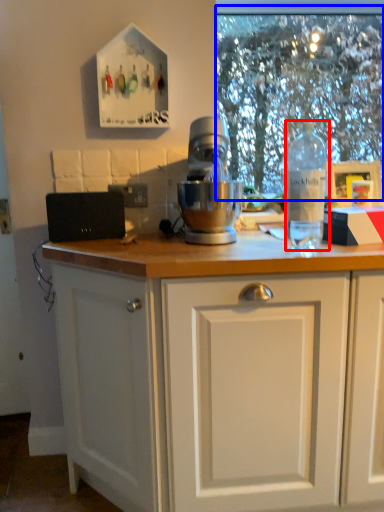
Question: Which of the following is the farthest to the observer, bottle (highlighted by a red box) or clear (highlighted by a blue box)?

Choices:
 (A) bottle
 (B) clear

Answer: (B)